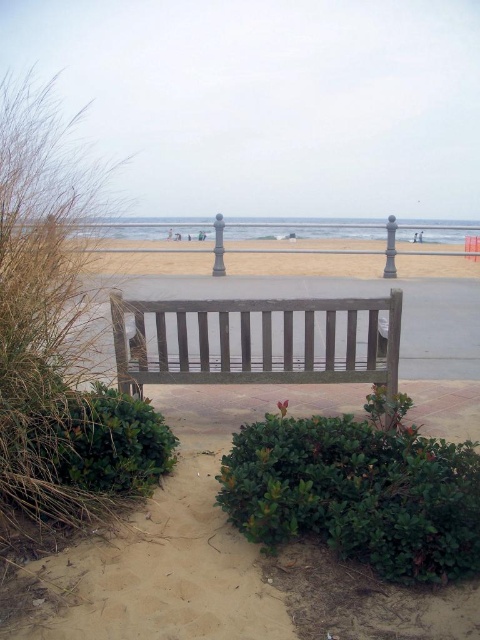
Does green leafy bush at lower center have a greater height compared to wooden bench at center?

In fact, green leafy bush at lower center may be shorter than wooden bench at center.

Which is in front, point (437, 465) or point (360, 371)?

Point (437, 465) is in front.

I want to click on green leafy bush at lower center, so click(x=358, y=490).

Does wooden bench at center have a larger size compared to green leafy bush at lower left?

Indeed, wooden bench at center has a larger size compared to green leafy bush at lower left.

Does point (187, 308) come farther from viewer compared to point (164, 419)?

That is False.

Locate an element on the screen. This screenshot has height=640, width=480. wooden bench at center is located at coordinates (259, 342).

Can you confirm if wooden bench at center is bigger than beige sand at center?

Incorrect, wooden bench at center is not larger than beige sand at center.

Is wooden bench at center thinner than beige sand at center?

Yes, wooden bench at center is thinner than beige sand at center.

The image size is (480, 640). What do you see at coordinates (259, 342) in the screenshot?
I see `wooden bench at center` at bounding box center [259, 342].

Where is `wooden bench at center`? The width and height of the screenshot is (480, 640). wooden bench at center is located at coordinates pos(259,342).